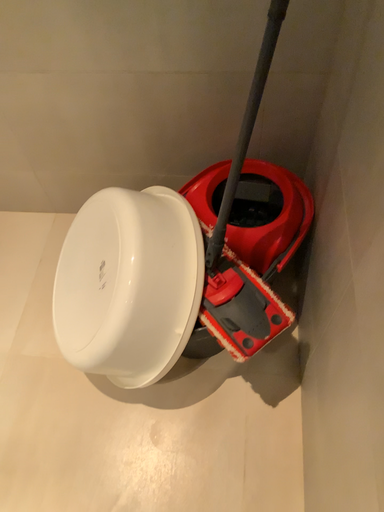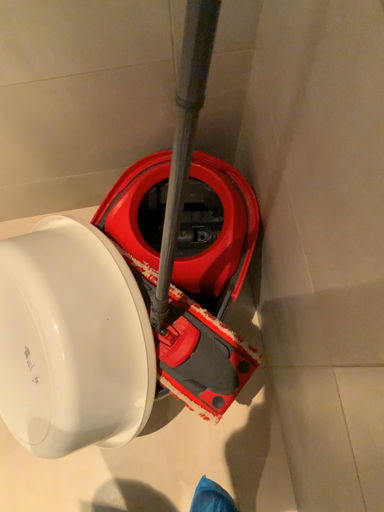
Question: Which way did the camera rotate in the video?

Choices:
 (A) rotated left
 (B) rotated right

Answer: (B)